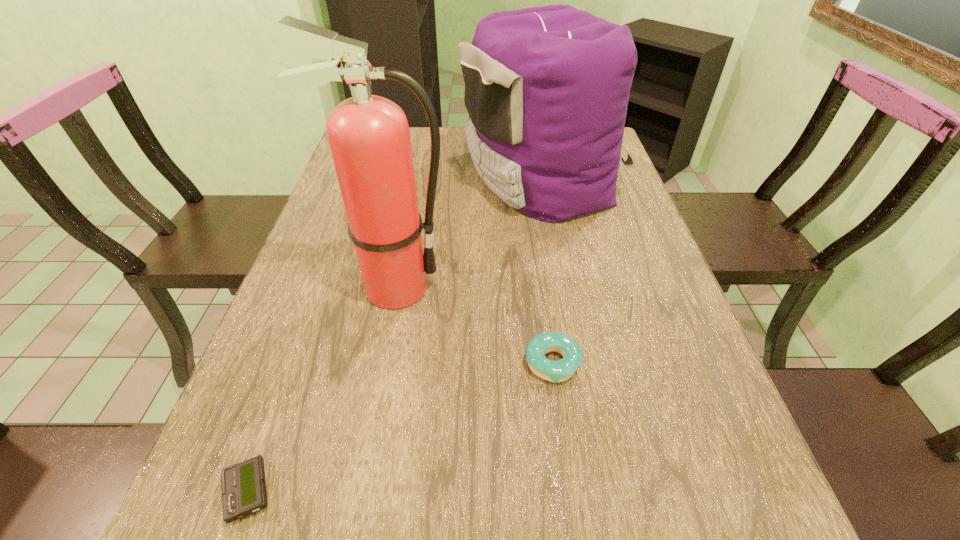
Find the location of `free region located 0.300m on the front pocket of the backpack`. free region located 0.300m on the front pocket of the backpack is located at coordinates (359, 177).

Identify the location of blank space located on the front pocket of the backpack. Image resolution: width=960 pixels, height=540 pixels. (356, 177).

This screenshot has width=960, height=540. I want to click on vacant region located on the left of the doughnut, so click(477, 363).

What are the coordinates of `free space located 0.050m on the back of the nearest object` in the screenshot? It's located at (270, 431).

Identify the location of object positioned at the far edge. This screenshot has height=540, width=960. (547, 88).

Identify the location of object that is at the near edge. (244, 492).

Where is `fire extinguisher positioned at the left edge`? This screenshot has height=540, width=960. fire extinguisher positioned at the left edge is located at coordinates (369, 138).

Locate an element on the screen. beeper present at the left edge is located at coordinates (244, 492).

This screenshot has width=960, height=540. I want to click on object situated at the right edge, so (x=547, y=88).

What are the coordinates of `object present at the near left corner` in the screenshot? It's located at (244, 492).